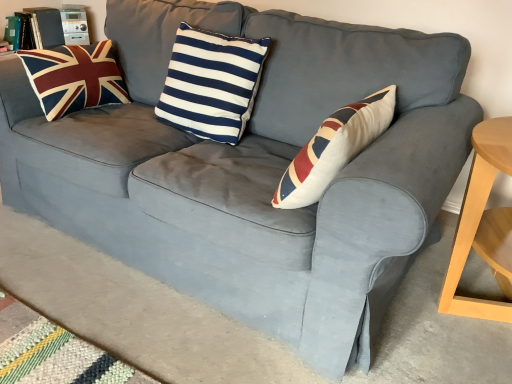
Question: Which direction should I rotate to look at navy/white striped cushion at center, positioned as the 2th pillow in left-to-right order, — up or down?

Choices:
 (A) down
 (B) up

Answer: (B)

Question: Is velvet union jack pillow at left, the first pillow from the left, not close to navy/white striped cushion at center, the first pillow from the right?

Choices:
 (A) no
 (B) yes

Answer: (A)

Question: Can you confirm if velvet union jack pillow at left, the first pillow from the left, is positioned to the right of navy/white striped cushion at center, the first pillow from the right?

Choices:
 (A) yes
 (B) no

Answer: (B)

Question: Could you tell me if velvet union jack pillow at left, the first pillow from the left, is turned towards navy/white striped cushion at center, the first pillow from the right?

Choices:
 (A) yes
 (B) no

Answer: (A)

Question: Can you confirm if velvet union jack pillow at left, the first pillow from the left, is bigger than navy/white striped cushion at center, the first pillow from the right?

Choices:
 (A) yes
 (B) no

Answer: (B)

Question: Is velvet union jack pillow at left, the first pillow from the left, beside navy/white striped cushion at center, positioned as the 2th pillow in left-to-right order?

Choices:
 (A) no
 (B) yes

Answer: (A)

Question: Considering the relative sizes of velvet union jack pillow at left, the first pillow from the left, and navy/white striped cushion at center, positioned as the 2th pillow in left-to-right order, in the image provided, is velvet union jack pillow at left, the first pillow from the left, smaller than navy/white striped cushion at center, positioned as the 2th pillow in left-to-right order,?

Choices:
 (A) yes
 (B) no

Answer: (A)

Question: From a real-world perspective, is navy/white striped cushion at center, the first pillow from the right, on top of velvet union jack pillow at left, which is the second pillow in right-to-left order?

Choices:
 (A) no
 (B) yes

Answer: (B)

Question: Is navy/white striped cushion at center, the first pillow from the right, aimed at velvet union jack pillow at left, the first pillow from the left?

Choices:
 (A) no
 (B) yes

Answer: (A)

Question: Does navy/white striped cushion at center, the first pillow from the right, have a larger size compared to velvet union jack pillow at left, which is the second pillow in right-to-left order?

Choices:
 (A) no
 (B) yes

Answer: (B)

Question: Does navy/white striped cushion at center, positioned as the 2th pillow in left-to-right order, have a greater width compared to velvet union jack pillow at left, which is the second pillow in right-to-left order?

Choices:
 (A) yes
 (B) no

Answer: (B)

Question: Is navy/white striped cushion at center, the first pillow from the right, next to velvet union jack pillow at left, which is the second pillow in right-to-left order?

Choices:
 (A) yes
 (B) no

Answer: (B)

Question: From the image's perspective, is navy/white striped cushion at center, the first pillow from the right, under velvet union jack pillow at left, which is the second pillow in right-to-left order?

Choices:
 (A) yes
 (B) no

Answer: (A)

Question: Based on their sizes in the image, would you say velvet union jack pillow at left, which is the second pillow in right-to-left order, is bigger or smaller than navy/white striped cushion at center, positioned as the 2th pillow in left-to-right order?

Choices:
 (A) small
 (B) big

Answer: (A)